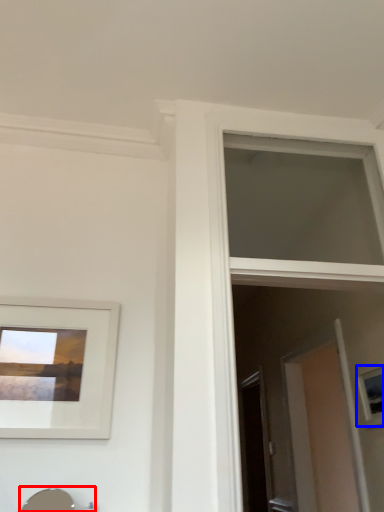
Question: Which point is further to the camera, sink (highlighted by a red box) or picture frame (highlighted by a blue box)?

Choices:
 (A) sink
 (B) picture frame

Answer: (B)